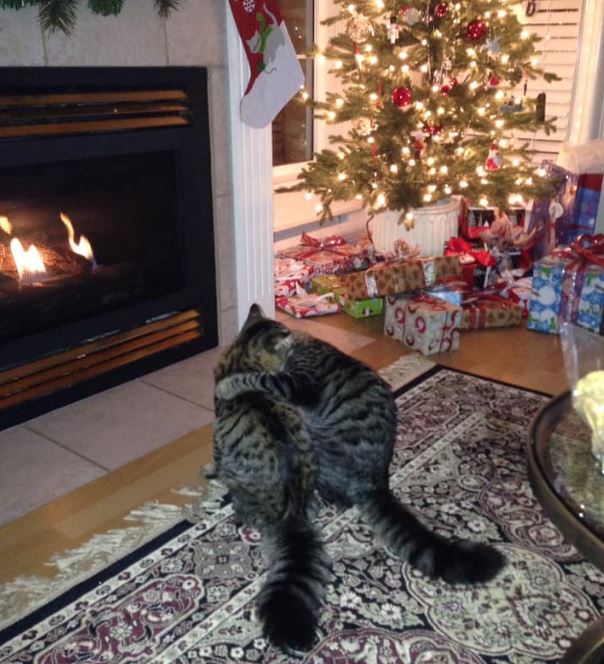
At what (x,y) coordinates should I click in order to perform the action: click on christmas tree. Please return your answer as a coordinate pair (x, y). Looking at the image, I should click on pyautogui.click(x=431, y=46).